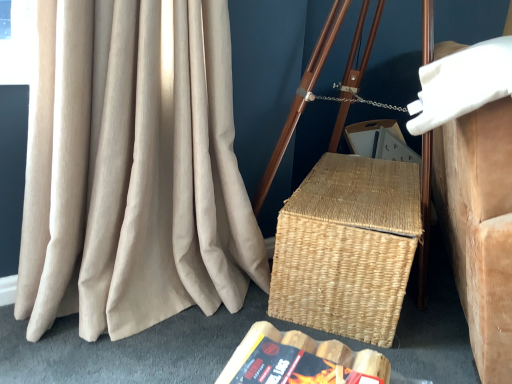
What is the approximate width of hardcover book at lower center?

It is 22.10 centimeters.

What are the coordinates of `beige corduroy curtain at left` in the screenshot? It's located at coord(133,169).

What do you see at coordinates (347, 247) in the screenshot? The width and height of the screenshot is (512, 384). I see `natural woven picnic basket at center` at bounding box center [347, 247].

Where is `white foam pillow at upper right`? white foam pillow at upper right is located at coordinates (479, 224).

What is the approximate width of white foam pillow at upper right?

25.62 inches.

Image resolution: width=512 pixels, height=384 pixels. I want to click on hardcover book at lower center, so click(x=293, y=367).

Is white foam pillow at upper right inside natural woven picnic basket at center?

No, white foam pillow at upper right is located outside of natural woven picnic basket at center.

From a real-world perspective, is natural woven picnic basket at center located higher than white foam pillow at upper right?

No, from a real-world perspective, natural woven picnic basket at center is not on top of white foam pillow at upper right.

Is natural woven picnic basket at center taller or shorter than white foam pillow at upper right?

In the image, natural woven picnic basket at center appears to be shorter than white foam pillow at upper right.

Measure the distance between natural woven picnic basket at center and hardcover book at lower center.

They are 44.43 centimeters apart.

Between natural woven picnic basket at center and hardcover book at lower center, which one has less height?

hardcover book at lower center is shorter.

This screenshot has height=384, width=512. Identify the location of paperback book below the natural woven picnic basket at center (from the image's perspective). (293, 367).

Between natural woven picnic basket at center and hardcover book at lower center, which one has smaller width?

hardcover book at lower center is thinner.

Consider the image. From the image's perspective, is hardcover book at lower center on top of beige corduroy curtain at left?

No.

Looking at this image, considering the positions of objects hardcover book at lower center and beige corduroy curtain at left in the image provided, who is more to the right, hardcover book at lower center or beige corduroy curtain at left?

hardcover book at lower center is more to the right.

From their relative heights in the image, would you say hardcover book at lower center is taller or shorter than beige corduroy curtain at left?

hardcover book at lower center is shorter than beige corduroy curtain at left.

From a real-world perspective, between hardcover book at lower center and beige corduroy curtain at left, who is vertically lower?

hardcover book at lower center is physically lower.

In the scene shown: Is hardcover book at lower center located within white foam pillow at upper right?

No, hardcover book at lower center is located outside of white foam pillow at upper right.

Considering the positions of point (492, 353) and point (346, 378), is point (492, 353) closer or farther from the camera than point (346, 378)?

Point (492, 353) is positioned farther from the camera compared to point (346, 378).

From the image's perspective, is white foam pillow at upper right above or below hardcover book at lower center?

Based on their image positions, white foam pillow at upper right is located above hardcover book at lower center.

Is white foam pillow at upper right turned away from hardcover book at lower center?

That's not correct — white foam pillow at upper right is not looking away from hardcover book at lower center.

Between natural woven picnic basket at center and beige corduroy curtain at left, which one has smaller size?

natural woven picnic basket at center.

Is natural woven picnic basket at center in contact with beige corduroy curtain at left?

There is a gap between natural woven picnic basket at center and beige corduroy curtain at left.

Considering the relative sizes of natural woven picnic basket at center and beige corduroy curtain at left in the image provided, is natural woven picnic basket at center wider than beige corduroy curtain at left?

Correct, the width of natural woven picnic basket at center exceeds that of beige corduroy curtain at left.

Do you think natural woven picnic basket at center is within beige corduroy curtain at left, or outside of it?

natural woven picnic basket at center lies outside beige corduroy curtain at left.

Considering the relative positions of white foam pillow at upper right and beige corduroy curtain at left in the image provided, is white foam pillow at upper right to the left or to the right of beige corduroy curtain at left?

Based on their positions, white foam pillow at upper right is located to the right of beige corduroy curtain at left.

Could you tell me if white foam pillow at upper right is facing beige corduroy curtain at left?

No, white foam pillow at upper right is not oriented towards beige corduroy curtain at left.

From the image's perspective, between white foam pillow at upper right and beige corduroy curtain at left, who is located below?

beige corduroy curtain at left is shown below in the image.

Which of these two, white foam pillow at upper right or beige corduroy curtain at left, stands shorter?

With less height is white foam pillow at upper right.

Is white foam pillow at upper right inside the boundaries of natural woven picnic basket at center, or outside?

white foam pillow at upper right is not inside natural woven picnic basket at center, it's outside.

This screenshot has width=512, height=384. In order to click on picnic basket located on the left of white foam pillow at upper right in this screenshot , I will do `click(347, 247)`.

What's the angular difference between white foam pillow at upper right and natural woven picnic basket at center's facing directions?

The angular difference between white foam pillow at upper right and natural woven picnic basket at center is 1.93 degrees.

The height and width of the screenshot is (384, 512). In order to click on picnic basket behind the white foam pillow at upper right in this screenshot , I will do `click(347, 247)`.

Image resolution: width=512 pixels, height=384 pixels. I want to click on paperback book below the natural woven picnic basket at center (from a real-world perspective), so tap(293, 367).

Based on their spatial positions, is white foam pillow at upper right or hardcover book at lower center closer to natural woven picnic basket at center?

white foam pillow at upper right is positioned closer to the anchor natural woven picnic basket at center.

From the image, which object appears to be nearer to beige corduroy curtain at left, white foam pillow at upper right or natural woven picnic basket at center?

Among the two, natural woven picnic basket at center is located nearer to beige corduroy curtain at left.

Consider the image. Based on their spatial positions, is beige corduroy curtain at left or hardcover book at lower center closer to white foam pillow at upper right?

hardcover book at lower center is closer to white foam pillow at upper right.

Which object lies nearer to the anchor point hardcover book at lower center, white foam pillow at upper right or natural woven picnic basket at center?

natural woven picnic basket at center is closer to hardcover book at lower center.

Considering their positions, is white foam pillow at upper right positioned closer to beige corduroy curtain at left than hardcover book at lower center?

hardcover book at lower center is positioned closer to the anchor beige corduroy curtain at left.

Considering their positions, is natural woven picnic basket at center positioned further to hardcover book at lower center than white foam pillow at upper right?

white foam pillow at upper right is further to hardcover book at lower center.

Which object lies nearer to the anchor point natural woven picnic basket at center, hardcover book at lower center or white foam pillow at upper right?

white foam pillow at upper right is positioned closer to the anchor natural woven picnic basket at center.

Consider the image. From the image, which object appears to be farther from beige corduroy curtain at left, hardcover book at lower center or white foam pillow at upper right?

white foam pillow at upper right is further to beige corduroy curtain at left.

What are the coordinates of `paperback book between beige corduroy curtain at left and natural woven picnic basket at center from left to right` in the screenshot? It's located at (293, 367).

Image resolution: width=512 pixels, height=384 pixels. I want to click on picnic basket located between hardcover book at lower center and white foam pillow at upper right in the left-right direction, so click(347, 247).

I want to click on paperback book between beige corduroy curtain at left and white foam pillow at upper right from left to right, so click(x=293, y=367).

Locate an element on the screen. This screenshot has height=384, width=512. picnic basket situated between beige corduroy curtain at left and white foam pillow at upper right from left to right is located at coordinates (347, 247).